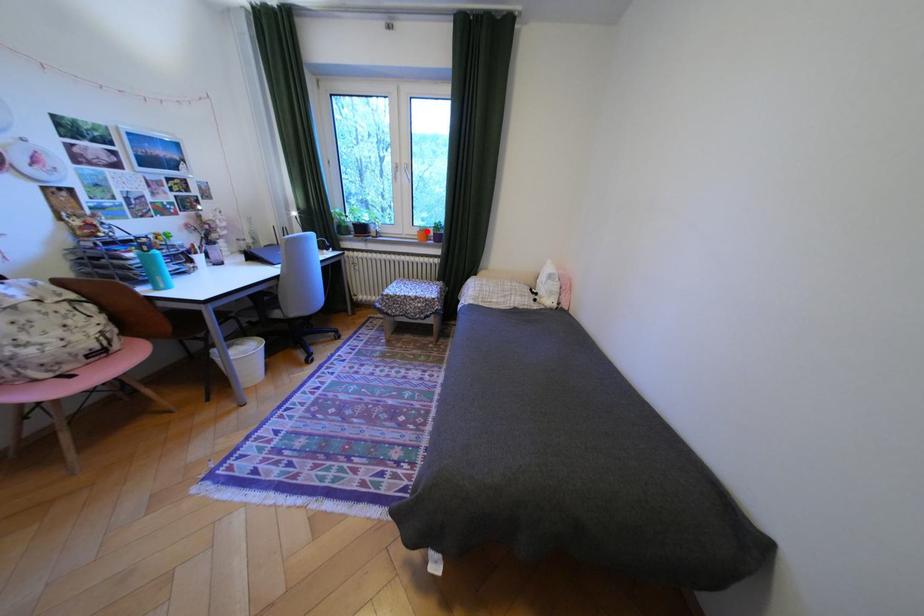
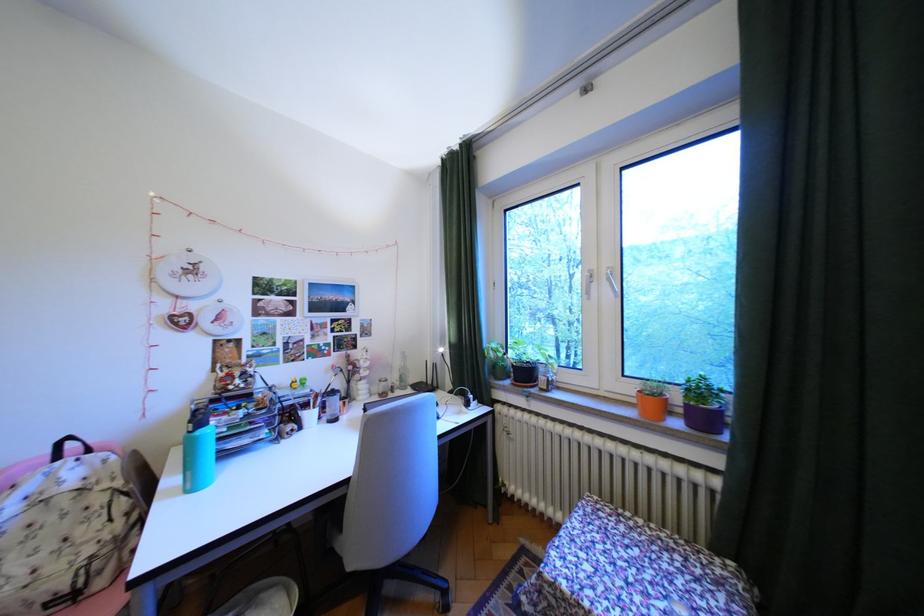
The point at the highlighted location is marked in the first image. Where is the corresponding point in the second image?

(641, 390)